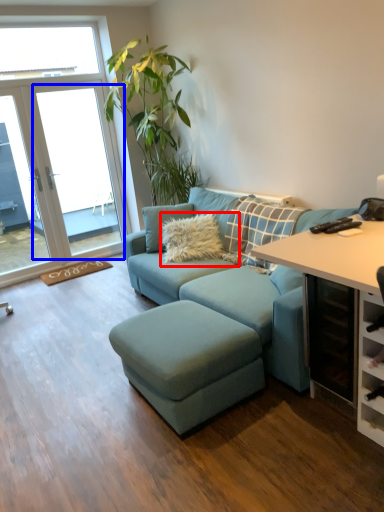
Question: Which object is closer to the camera taking this photo, pillow (highlighted by a red box) or window screen (highlighted by a blue box)?

Choices:
 (A) pillow
 (B) window screen

Answer: (A)